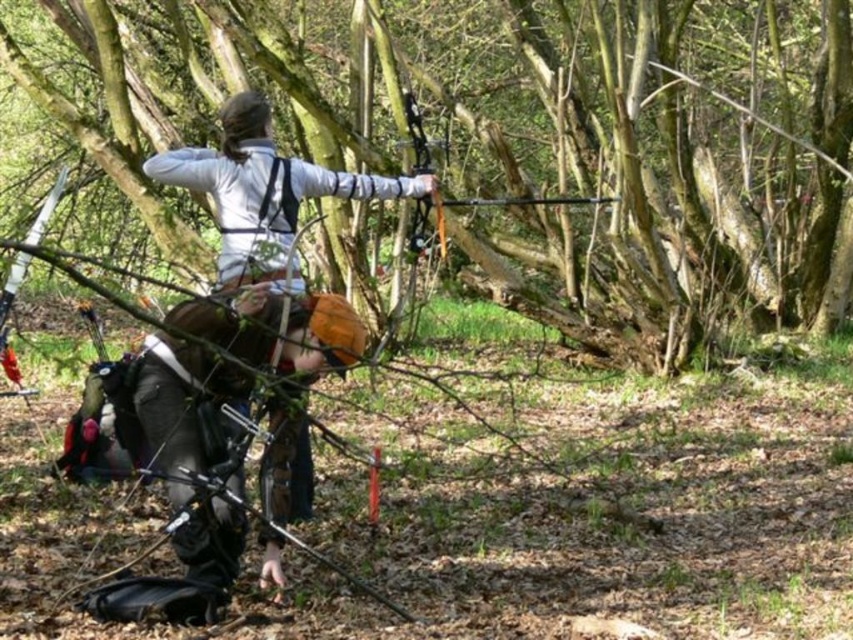
Question: Which object is closer to the camera taking this photo?

Choices:
 (A) brown leather backpack at center
 (B) rough bark tree at center
 (C) matte white jacket at center

Answer: (A)

Question: Does brown leather backpack at center have a larger size compared to matte black bow at center?

Choices:
 (A) yes
 (B) no

Answer: (A)

Question: Is rough bark tree at center bigger than matte black bow at center?

Choices:
 (A) yes
 (B) no

Answer: (A)

Question: Which point is closer to the camera?

Choices:
 (A) (421, 116)
 (B) (833, 200)
 (C) (285, 157)
 (D) (204, 358)

Answer: (D)

Question: Is rough bark tree at center below brown leather backpack at center?

Choices:
 (A) no
 (B) yes

Answer: (A)

Question: Which point is farther from the camera taking this photo?

Choices:
 (A) (401, 188)
 (B) (700, 250)
 (C) (233, 534)
 (D) (440, 227)

Answer: (B)